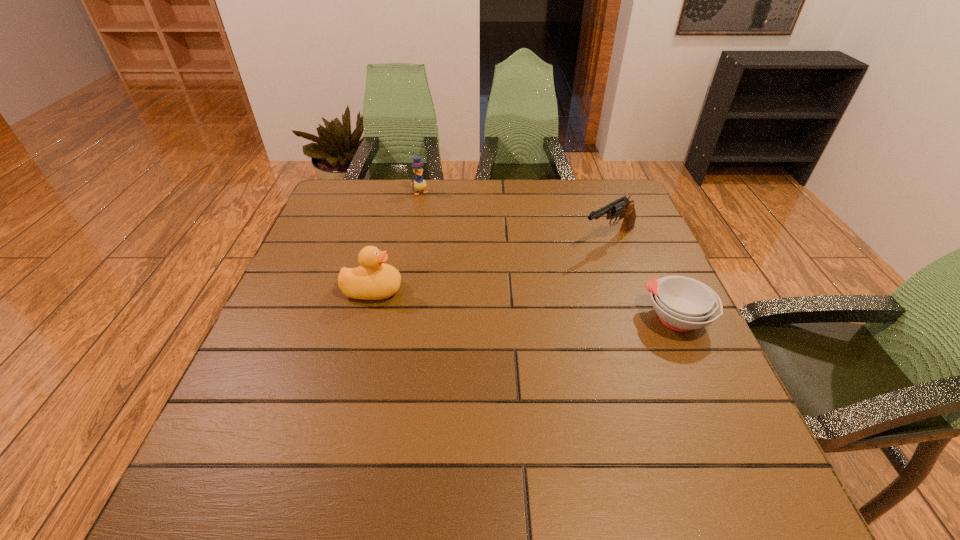
This screenshot has width=960, height=540. In order to click on free space between the gun and the farthest object in this screenshot , I will do `click(515, 216)`.

This screenshot has height=540, width=960. I want to click on unoccupied area between the third nearest object and the shortest object, so click(x=643, y=279).

Identify the location of object that stands as the closest to the third nearest object. (682, 303).

Find the location of a particular element. The height and width of the screenshot is (540, 960). object identified as the second closest to the second farthest object is located at coordinates (419, 184).